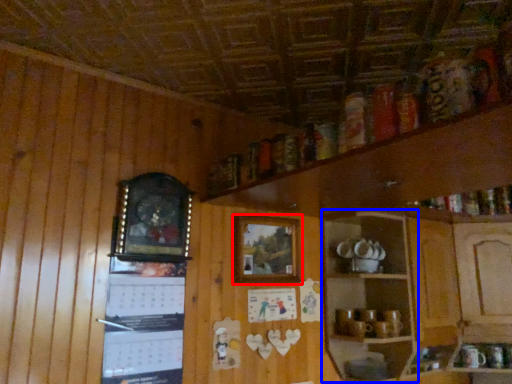
Question: Which of the following is the farthest to the observer, picture frame (highlighted by a red box) or shelf (highlighted by a blue box)?

Choices:
 (A) picture frame
 (B) shelf

Answer: (A)